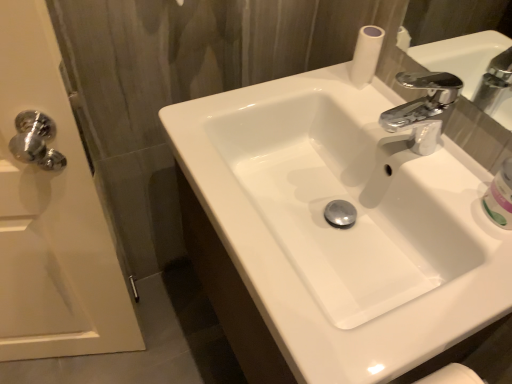
Identify the location of free point behind white glossy mouthwash at right. The image size is (512, 384). (445, 155).